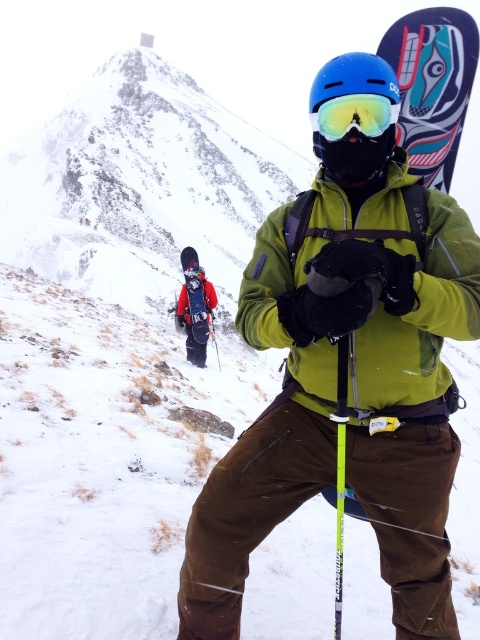
You are a drone operator tasked with capturing aerial footage of the snowboarders. You need to ensure your drone can fly between the green matte jacket at center and the matte black snowboard at center without any obstacles. What is the minimum distance your drone must be able to fly to cover the space between them?

The green matte jacket at center and the matte black snowboard at center are 26.41 meters apart from each other. Therefore, the drone must be capable of flying at least 26.41 meters to cover the distance between them.

Looking at this image, you are a winter sports equipment inspector checking the snowboards in the image. Which snowboard, the dark blue painted wood snowboard at center or the matte black snowboard at center, is taller?

The dark blue painted wood snowboard at center is much taller than the matte black snowboard at center.